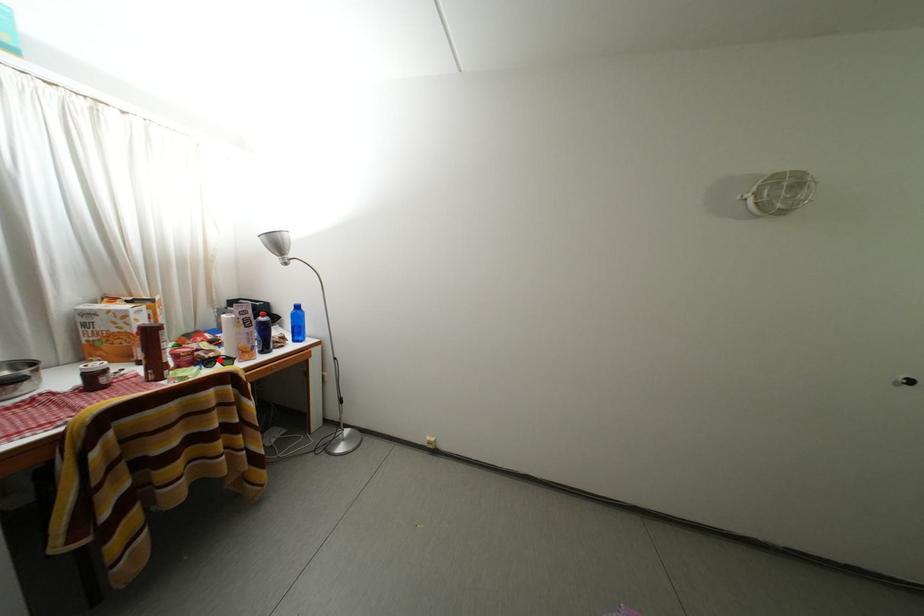
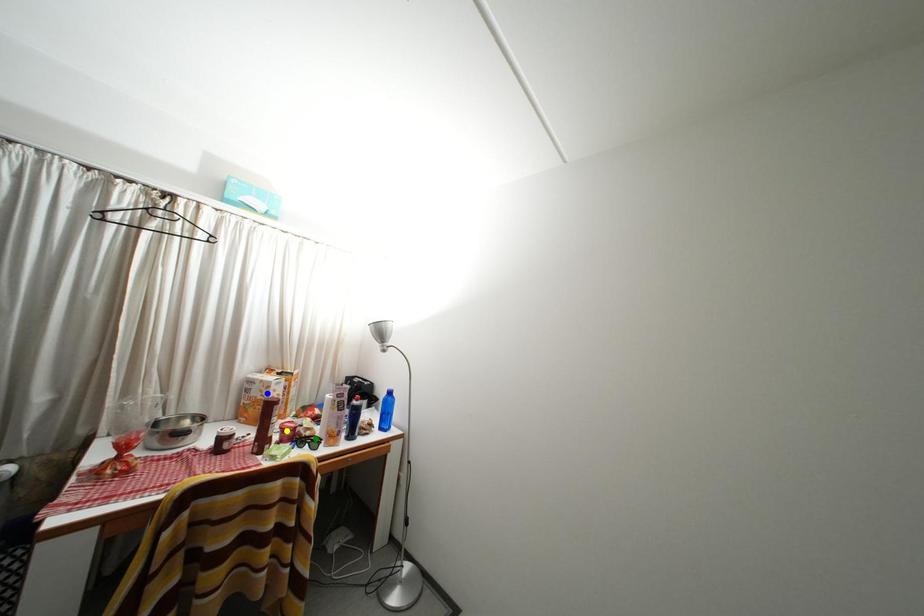
Question: I am providing you with two images of the same scene from different viewpoints. A red point is marked on the first image. You are given multiple points on the second image. Which mark in image 2 goes with the point in image 1?

Choices:
 (A) green point
 (B) yellow point
 (C) blue point

Answer: (A)